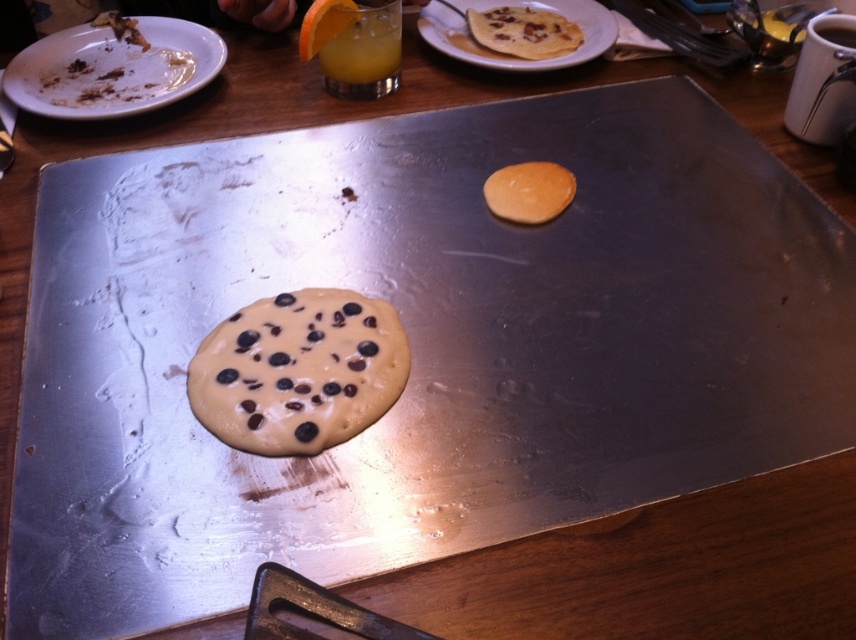
Between golden pancake at upper center and golden brown crispy pancake at upper right, which one has more height?

Standing taller between the two is golden pancake at upper center.

Between golden pancake at upper center and golden brown crispy pancake at upper right, which one appears on the left side from the viewer's perspective?

Positioned to the left is golden pancake at upper center.

Between point (470, 51) and point (506, 42), which one is positioned behind?

The point (506, 42) is behind.

Find the location of a particular element. The height and width of the screenshot is (640, 856). golden pancake at upper center is located at coordinates (508, 52).

Is point (488, 182) farther from viewer compared to point (310, 54)?

That is False.

Is point (569, 195) more distant than point (317, 38)?

That is False.

At what (x,y) coordinates should I click in order to perform the action: click on golden brown pancake at center. Please return your answer as a coordinate pair (x, y). Looking at the image, I should click on (528, 192).

Does chocolate chip pancake at center come behind white matte plate at upper left?

That is False.

Is point (393, 336) farther from camera compared to point (34, 67)?

No, (393, 336) is in front of (34, 67).

Identify the location of chocolate chip pancake at center. click(298, 371).